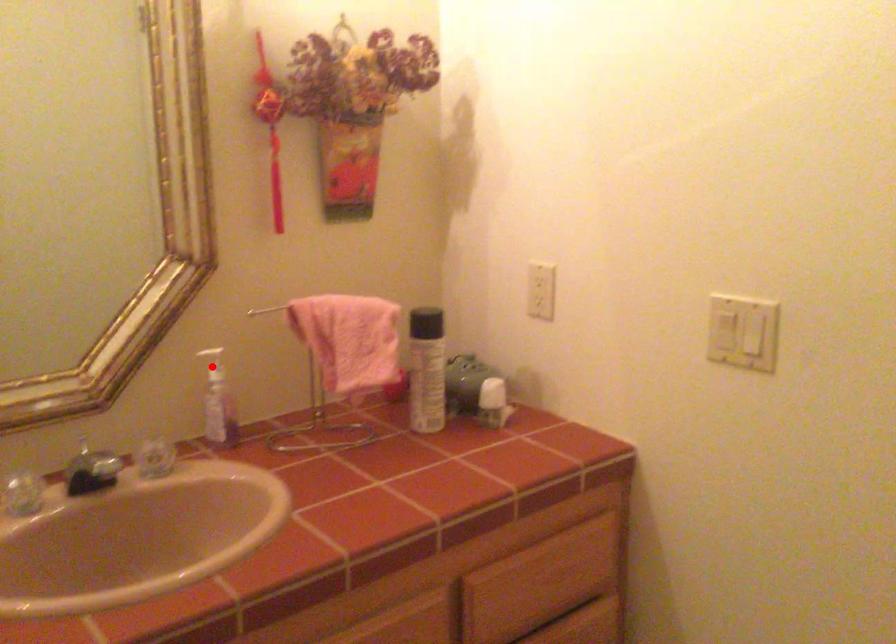
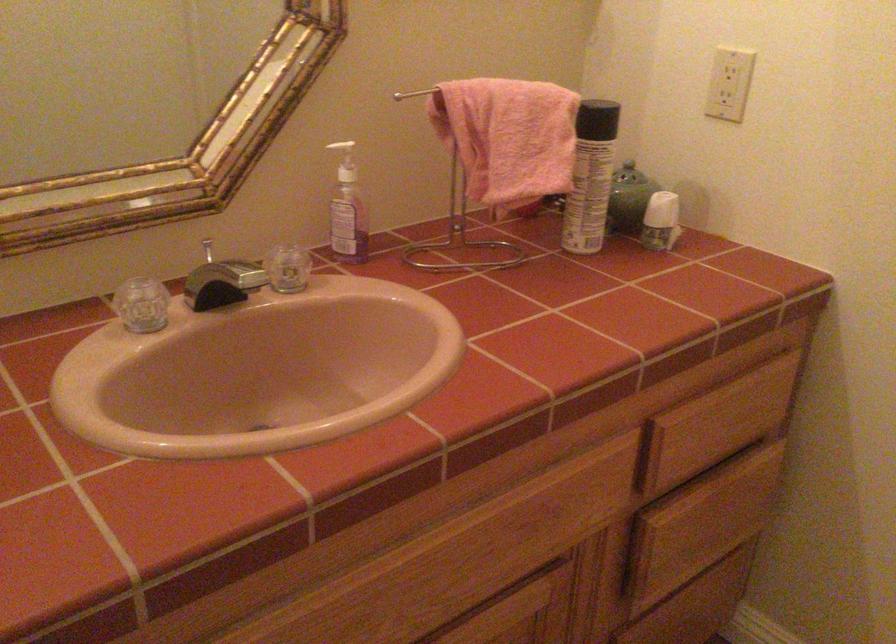
Question: I am providing you with two images of the same scene from different viewpoints. A red point is shown in image1. For the corresponding object point in image2, is it positioned nearer or farther from the camera?

Choices:
 (A) Nearer
 (B) Farther

Answer: (A)